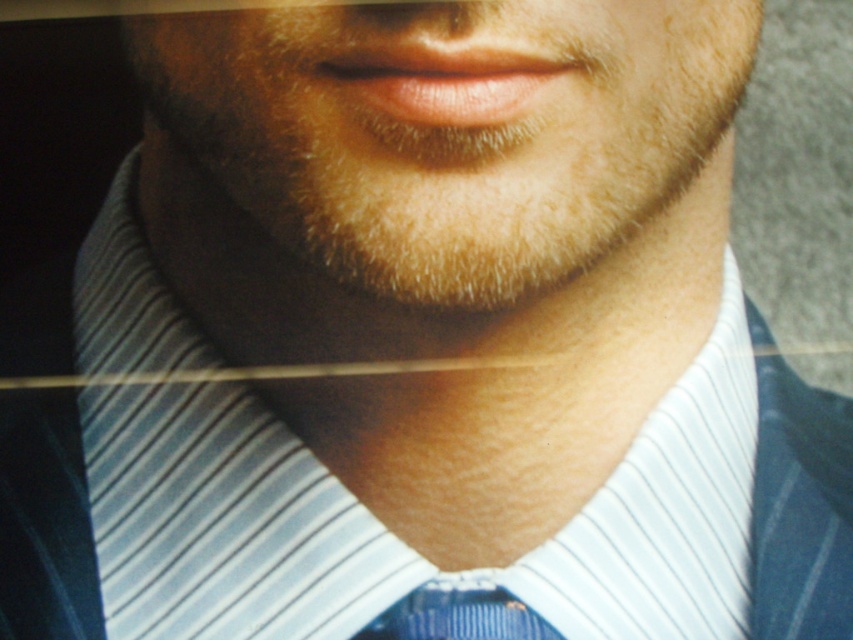
You are a photographer adjusting the focus of a portrait. You want to ensure the smooth skin at center is sharp while keeping the blue striped tie at center slightly blurred. Based on the scene, is this possible?

Yes, because the smooth skin at center is in front of the blue striped tie at center. By focusing on the smooth skin at center, the blue striped tie at center will naturally be slightly out of focus.

Looking at this image, you are a tailor examining the image of a person wearing a striped shirt and a tie. You need to determine which item, the white striped fabric at center or the blue striped tie at center, has a greater vertical height in the image. Based on the provided scene description, which one is taller?

The white striped fabric at center is taller than the blue striped tie at center according to the description.